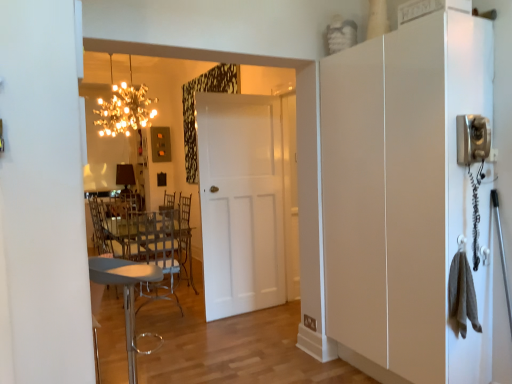
Question: Is the surface of sparkling crystal chandelier at upper center in direct contact with white matte cabinet at right?

Choices:
 (A) yes
 (B) no

Answer: (B)

Question: Does sparkling crystal chandelier at upper center have a lesser width compared to white matte cabinet at right?

Choices:
 (A) no
 (B) yes

Answer: (A)

Question: From the image's perspective, is sparkling crystal chandelier at upper center located beneath white matte cabinet at right?

Choices:
 (A) no
 (B) yes

Answer: (A)

Question: Can you confirm if sparkling crystal chandelier at upper center is positioned to the right of white matte cabinet at right?

Choices:
 (A) no
 (B) yes

Answer: (A)

Question: Can you confirm if sparkling crystal chandelier at upper center is shorter than white matte cabinet at right?

Choices:
 (A) yes
 (B) no

Answer: (A)

Question: Considering the relative sizes of sparkling crystal chandelier at upper center and white matte cabinet at right in the image provided, is sparkling crystal chandelier at upper center bigger than white matte cabinet at right?

Choices:
 (A) yes
 (B) no

Answer: (B)

Question: Is metallic gray stool at lower left, which ranks as the 1th chair in front-to-back order, beside sparkling crystal chandelier at upper center?

Choices:
 (A) no
 (B) yes

Answer: (A)

Question: Is metallic gray stool at lower left, the 2th chair from the back, positioned far away from sparkling crystal chandelier at upper center?

Choices:
 (A) yes
 (B) no

Answer: (A)

Question: Is metallic gray stool at lower left, the 2th chair from the back, outside sparkling crystal chandelier at upper center?

Choices:
 (A) no
 (B) yes

Answer: (B)

Question: Is metallic gray stool at lower left, which ranks as the 1th chair in front-to-back order, to the left of sparkling crystal chandelier at upper center from the viewer's perspective?

Choices:
 (A) yes
 (B) no

Answer: (B)

Question: Is metallic gray stool at lower left, the 2th chair from the back, in front of sparkling crystal chandelier at upper center?

Choices:
 (A) yes
 (B) no

Answer: (A)

Question: Is metallic gray stool at lower left, which ranks as the 1th chair in front-to-back order, taller than sparkling crystal chandelier at upper center?

Choices:
 (A) yes
 (B) no

Answer: (A)

Question: From the image's perspective, is clear plastic chair at center, which is the 1th chair in back-to-front order, located beneath sparkling crystal chandelier at upper center?

Choices:
 (A) no
 (B) yes

Answer: (B)